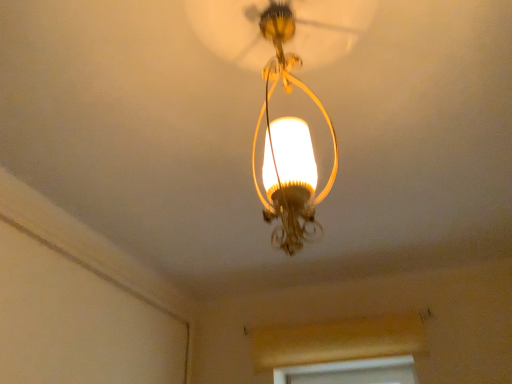
Image resolution: width=512 pixels, height=384 pixels. What do you see at coordinates (338, 341) in the screenshot?
I see `wooden window frame at lower center` at bounding box center [338, 341].

At what (x,y) coordinates should I click in order to perform the action: click on wooden window frame at lower center. Please return your answer as a coordinate pair (x, y). This screenshot has width=512, height=384. Looking at the image, I should click on (338, 341).

Find the location of `matte gold chandelier at center`. matte gold chandelier at center is located at coordinates (283, 70).

Measure the distance between matte gold chandelier at center and camera.

matte gold chandelier at center and camera are 29.00 inches apart.

Describe the element at coordinates (283, 70) in the screenshot. I see `matte gold chandelier at center` at that location.

Find the location of a particular element. The image size is (512, 384). wooden window frame at lower center is located at coordinates (338, 341).

Does matte gold chandelier at center appear on the right side of wooden window frame at lower center?

No.

Which object is more forward, matte gold chandelier at center or wooden window frame at lower center?

matte gold chandelier at center is closer to the camera.

Considering the points (231, 31) and (263, 330), which point is in front, point (231, 31) or point (263, 330)?

The point (231, 31) is closer to the camera.

From the image's perspective, between matte gold chandelier at center and wooden window frame at lower center, who is located below?

wooden window frame at lower center appears lower in the image.

From a real-world perspective, is matte gold chandelier at center on top of wooden window frame at lower center?

Yes, from a real-world perspective, matte gold chandelier at center is over wooden window frame at lower center

Considering the relative sizes of matte gold chandelier at center and wooden window frame at lower center in the image provided, is matte gold chandelier at center thinner than wooden window frame at lower center?

In fact, matte gold chandelier at center might be wider than wooden window frame at lower center.

Is matte gold chandelier at center shorter than wooden window frame at lower center?

No, matte gold chandelier at center is not shorter than wooden window frame at lower center.

Based on their sizes in the image, would you say matte gold chandelier at center is bigger or smaller than wooden window frame at lower center?

matte gold chandelier at center is bigger than wooden window frame at lower center.

Is matte gold chandelier at center not within wooden window frame at lower center?

Yes, matte gold chandelier at center is outside of wooden window frame at lower center.

Consider the image. Would you consider matte gold chandelier at center to be distant from wooden window frame at lower center?

That's right, there is a large distance between matte gold chandelier at center and wooden window frame at lower center.

Is wooden window frame at lower center at the back of matte gold chandelier at center?

No, wooden window frame at lower center is not at the back of matte gold chandelier at center.

Locate an element on the screen. window frame below the matte gold chandelier at center (from the image's perspective) is located at coordinates 338,341.

Can you confirm if wooden window frame at lower center is positioned to the left of matte gold chandelier at center?

No, wooden window frame at lower center is not to the left of matte gold chandelier at center.

Is wooden window frame at lower center positioned in front of matte gold chandelier at center?

No, wooden window frame at lower center is further to the viewer.

Which is behind, point (293, 360) or point (247, 19)?

The point (293, 360) is more distant.

From the image's perspective, which is above, wooden window frame at lower center or matte gold chandelier at center?

From the image's view, matte gold chandelier at center is above.

From a real-world perspective, is wooden window frame at lower center located higher than matte gold chandelier at center?

Actually, wooden window frame at lower center is physically below matte gold chandelier at center in the real world.

Is wooden window frame at lower center wider or thinner than matte gold chandelier at center?

Considering their sizes, wooden window frame at lower center looks slimmer than matte gold chandelier at center.

Who is shorter, wooden window frame at lower center or matte gold chandelier at center?

Standing shorter between the two is wooden window frame at lower center.

Considering the relative sizes of wooden window frame at lower center and matte gold chandelier at center in the image provided, is wooden window frame at lower center smaller than matte gold chandelier at center?

Yes, wooden window frame at lower center is smaller than matte gold chandelier at center.

Do you think wooden window frame at lower center is within matte gold chandelier at center, or outside of it?

wooden window frame at lower center cannot be found inside matte gold chandelier at center.

In the scene shown: Would you say wooden window frame at lower center is a long distance from matte gold chandelier at center?

Yes.

Is wooden window frame at lower center positioned with its back to matte gold chandelier at center?

That's not correct — wooden window frame at lower center is not looking away from matte gold chandelier at center.

What's the angular difference between wooden window frame at lower center and matte gold chandelier at center's facing directions?

The angular difference between wooden window frame at lower center and matte gold chandelier at center is 178 degrees.

Where is `lamp in front of the wooden window frame at lower center`? The image size is (512, 384). lamp in front of the wooden window frame at lower center is located at coordinates (283, 70).

The height and width of the screenshot is (384, 512). Find the location of `lamp that is in front of the wooden window frame at lower center`. lamp that is in front of the wooden window frame at lower center is located at coordinates (283, 70).

Image resolution: width=512 pixels, height=384 pixels. What are the coordinates of `window frame behind the matte gold chandelier at center` in the screenshot? It's located at (338, 341).